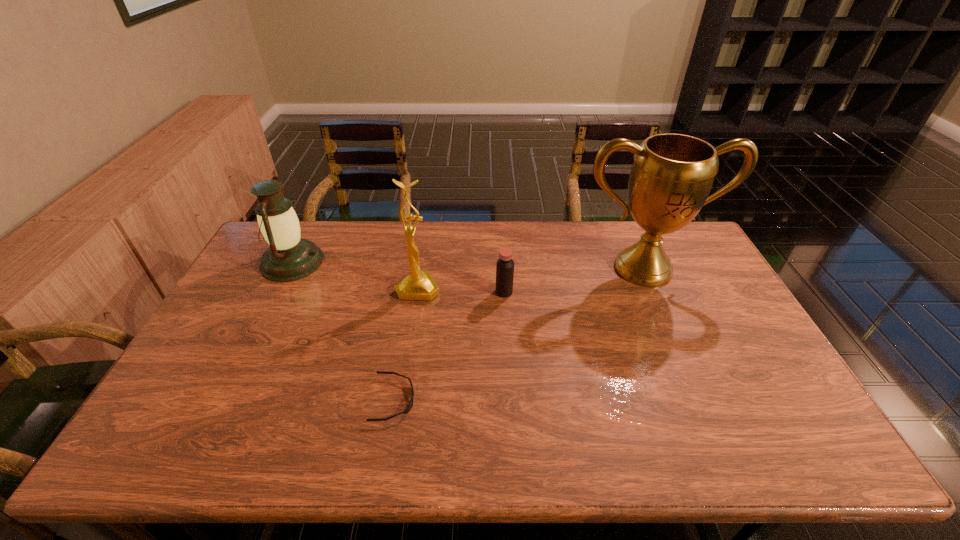
Locate an element on the screen. The image size is (960, 540). trophy cup is located at coordinates (672, 174).

The width and height of the screenshot is (960, 540). In order to click on the tallest object in this screenshot , I will do `click(672, 174)`.

Identify the location of the second tallest object. (419, 285).

This screenshot has width=960, height=540. Find the location of `the third shortest object`. the third shortest object is located at coordinates (289, 257).

Image resolution: width=960 pixels, height=540 pixels. In order to click on the leftmost object in this screenshot , I will do `click(289, 257)`.

You are a GUI agent. You are given a task and a screenshot of the screen. Output one action in this format:
    pyautogui.click(x=<x>, y=<y>)
    Task: Click on the second shortest object
    
    Given the screenshot: What is the action you would take?
    pyautogui.click(x=505, y=265)

This screenshot has height=540, width=960. I want to click on the fourth object from left to right, so click(x=505, y=265).

Find the location of a particular element. This screenshot has height=540, width=960. the nearest object is located at coordinates (408, 408).

The image size is (960, 540). I want to click on sunglasses, so click(408, 408).

This screenshot has width=960, height=540. I want to click on free space located 0.070m on the surface of the rightmost object with symbols, so click(x=660, y=307).